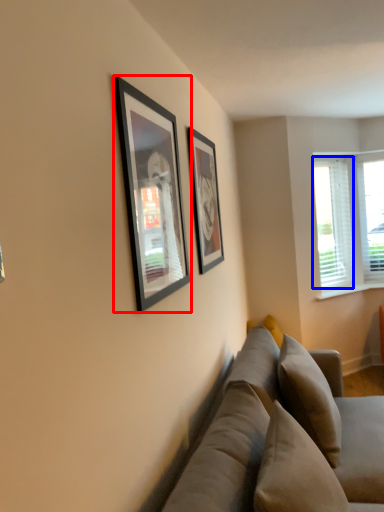
Question: Which of the following is the closest to the observer, picture frame (highlighted by a red box) or window screen (highlighted by a blue box)?

Choices:
 (A) picture frame
 (B) window screen

Answer: (A)